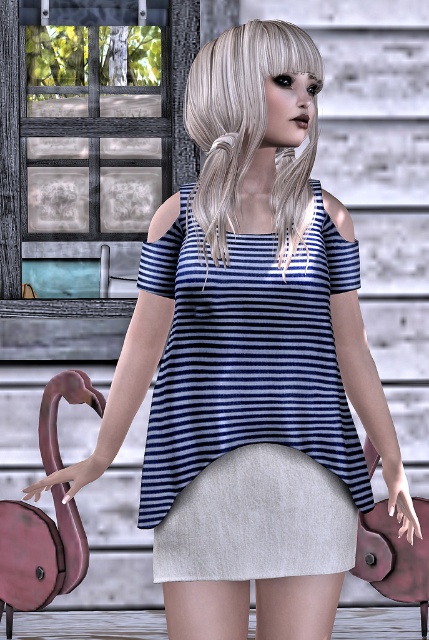
Question: In this image, where is blue striped fabric dress at center located relative to light gray cotton pencil skirt at center?

Choices:
 (A) right
 (B) left

Answer: (A)

Question: Does blue striped fabric dress at center appear under light gray cotton pencil skirt at center?

Choices:
 (A) no
 (B) yes

Answer: (A)

Question: Where is blue striped fabric dress at center located in relation to light gray cotton pencil skirt at center in the image?

Choices:
 (A) left
 (B) right

Answer: (B)

Question: Which object appears farthest from the camera in this image?

Choices:
 (A) light gray cotton pencil skirt at center
 (B) blue striped fabric dress at center

Answer: (A)